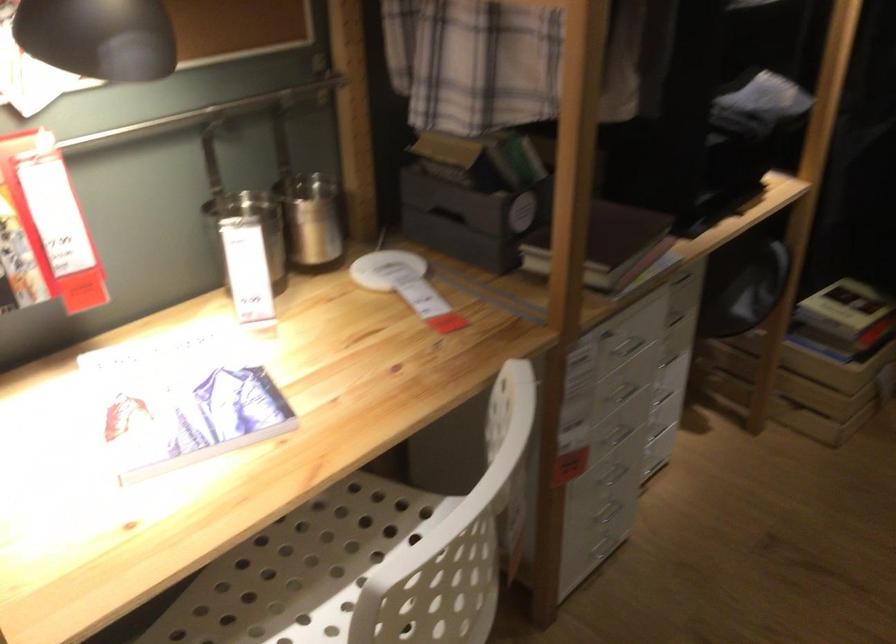
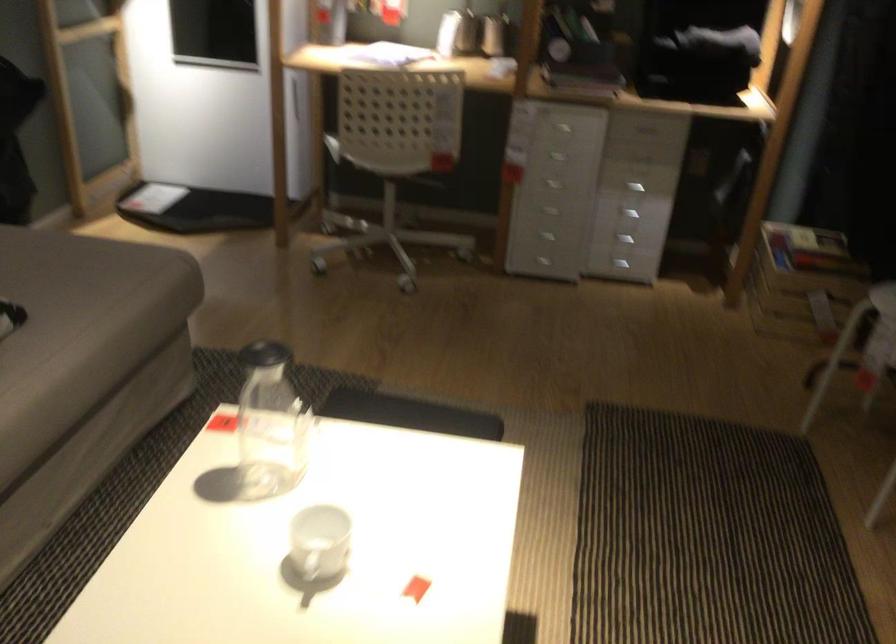
Where in the second image is the point corresponding to the point at 658,444 from the first image?

(625, 240)